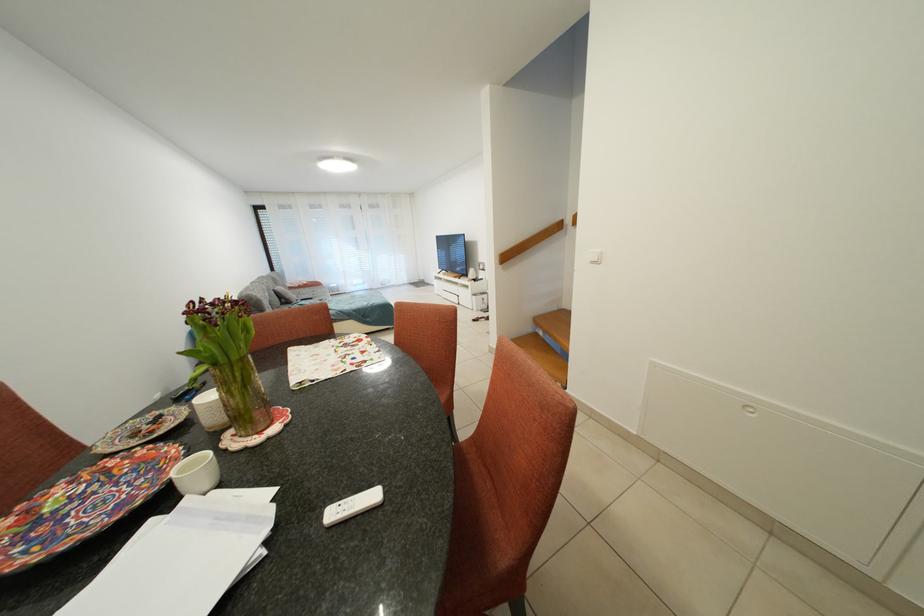
Describe the element at coordinates (748, 410) in the screenshot. I see `the white cabinet handle` at that location.